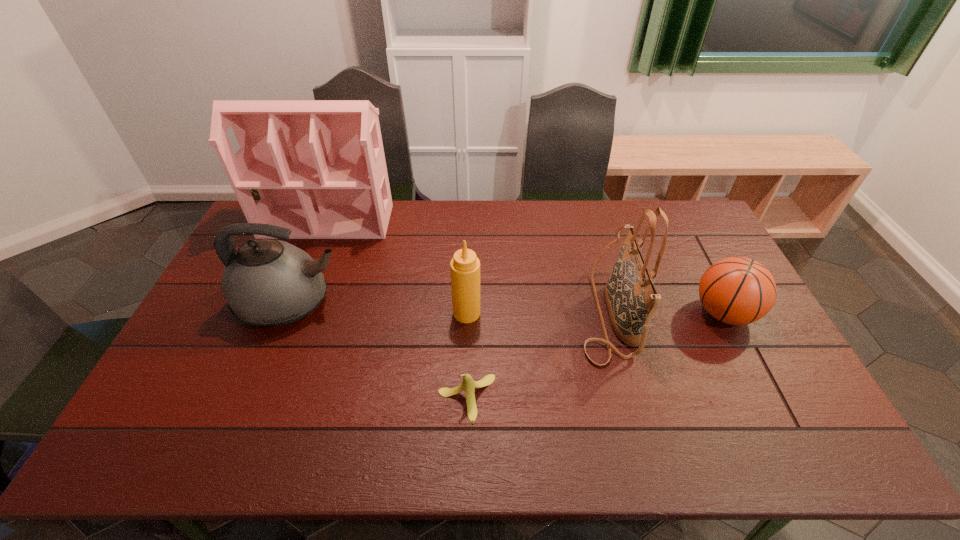
Where is `free space located 0.110m on the front-facing side of the tallest object`? free space located 0.110m on the front-facing side of the tallest object is located at coordinates (311, 261).

I want to click on vacant space located on the front-facing side of the second object from right to left, so click(487, 313).

Identify the location of vacant space located on the front-facing side of the second object from right to left. (533, 313).

I want to click on blank space located 0.370m on the front-facing side of the second object from right to left, so click(x=453, y=313).

Image resolution: width=960 pixels, height=540 pixels. Find the location of `free location located at the spout of the kettle`. free location located at the spout of the kettle is located at coordinates (373, 302).

Image resolution: width=960 pixels, height=540 pixels. Identify the location of free space located on the right of the condiment. (557, 313).

Locate an element on the screen. The width and height of the screenshot is (960, 540). free space located on the front of the rightmost object is located at coordinates (773, 410).

The width and height of the screenshot is (960, 540). Find the location of `free space located on the left of the shortest object`. free space located on the left of the shortest object is located at coordinates (344, 398).

Where is `object located at the far edge`? object located at the far edge is located at coordinates (319, 167).

Find the location of a particular element. This screenshot has height=540, width=960. object that is positioned at the near edge is located at coordinates (468, 384).